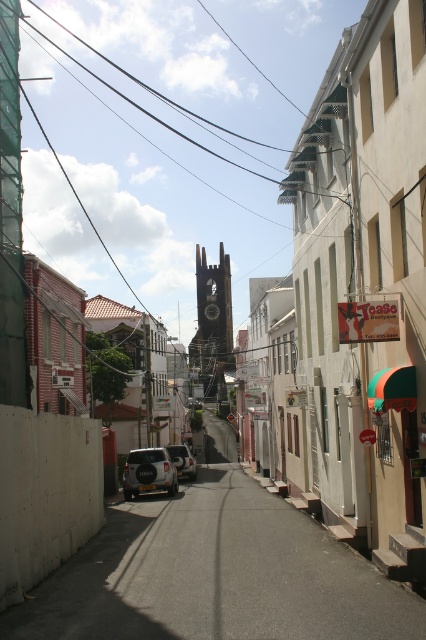
You are a delivery driver who needs to park your car, which is 5 meters long, between the dark gray stone spire at center and the white matte car at center. Can you fit your car there?

The dark gray stone spire at center and white matte car at center are 99.62 meters apart from each other. Since your car is only 5 meters long, there is sufficient space to park between them.

You are driving a car and want to park in the narrow street. You see the dark gray stone spire at center and the white matte car at center. Which object is closer to you, and would you need to move the car to park between them?

The dark gray stone spire at center is closer to you than the white matte car at center. Since the spire is closer, you would need to move the white matte car at center to park between them.